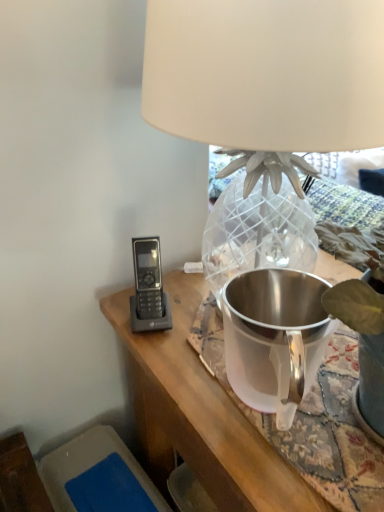
Image resolution: width=384 pixels, height=512 pixels. I want to click on satin silver pitcher at center, so click(x=274, y=338).

What is the approximate width of satin silver pitcher at center?

satin silver pitcher at center is 5.18 inches wide.

Measure the distance between satin silver pitcher at center and camera.

A distance of 18.31 inches exists between satin silver pitcher at center and camera.

Describe the element at coordinates (274, 338) in the screenshot. This screenshot has width=384, height=512. I see `satin silver pitcher at center` at that location.

At what (x,y) coordinates should I click in order to perform the action: click on matte white lampshade at upper center. Please return your answer as a coordinate pair (x, y). This screenshot has width=384, height=512. Looking at the image, I should click on (x=266, y=73).

Describe the element at coordinates (266, 73) in the screenshot. I see `matte white lampshade at upper center` at that location.

The height and width of the screenshot is (512, 384). What are the coordinates of `satin silver pitcher at center` in the screenshot? It's located at (274, 338).

Does satin silver pitcher at center appear on the left side of matte white lampshade at upper center?

Yes, satin silver pitcher at center is to the left of matte white lampshade at upper center.

Considering the positions of objects satin silver pitcher at center and matte white lampshade at upper center in the image provided, who is behind, satin silver pitcher at center or matte white lampshade at upper center?

satin silver pitcher at center is behind.

Between point (259, 397) and point (327, 116), which one is positioned in front?

The point (327, 116) is in front.

From the image's perspective, is satin silver pitcher at center over matte white lampshade at upper center?

Incorrect, from the image's perspective, satin silver pitcher at center is lower than matte white lampshade at upper center.

From a real-world perspective, which is physically above, satin silver pitcher at center or matte white lampshade at upper center?

In real-world perspective, matte white lampshade at upper center is above.

Which object is wider, satin silver pitcher at center or matte white lampshade at upper center?

With larger width is matte white lampshade at upper center.

Can you confirm if satin silver pitcher at center is taller than matte white lampshade at upper center?

In fact, satin silver pitcher at center may be shorter than matte white lampshade at upper center.

Looking at the image, does satin silver pitcher at center seem bigger or smaller compared to matte white lampshade at upper center?

Clearly, satin silver pitcher at center is smaller in size than matte white lampshade at upper center.

Is satin silver pitcher at center situated inside matte white lampshade at upper center or outside?

satin silver pitcher at center lies within the bounds of matte white lampshade at upper center.

Are satin silver pitcher at center and matte white lampshade at upper center located far from each other?

That's not correct — satin silver pitcher at center is a little close to matte white lampshade at upper center.

Is satin silver pitcher at center oriented towards matte white lampshade at upper center?

Yes, satin silver pitcher at center is aimed at matte white lampshade at upper center.

How different are the orientations of satin silver pitcher at center and matte white lampshade at upper center in degrees?

The angle between the facing direction of satin silver pitcher at center and the facing direction of matte white lampshade at upper center is 0.00037 degrees.

Identify the location of appliance on the left of matte white lampshade at upper center. (274, 338).

Does matte white lampshade at upper center appear on the right side of satin silver pitcher at center?

Yes, matte white lampshade at upper center is to the right of satin silver pitcher at center.

Which object is closer to the camera, matte white lampshade at upper center or satin silver pitcher at center?

matte white lampshade at upper center is more forward.

Which is in front, point (367, 3) or point (244, 310)?

The point (367, 3) is in front.

From the image's perspective, is matte white lampshade at upper center located beneath satin silver pitcher at center?

No.

From a real-world perspective, between matte white lampshade at upper center and satin silver pitcher at center, who is vertically higher?

From a 3D spatial view, matte white lampshade at upper center is above.

Can you confirm if matte white lampshade at upper center is thinner than satin silver pitcher at center?

No, matte white lampshade at upper center is not thinner than satin silver pitcher at center.

Does matte white lampshade at upper center have a lesser height compared to satin silver pitcher at center?

In fact, matte white lampshade at upper center may be taller than satin silver pitcher at center.

Which of these two, matte white lampshade at upper center or satin silver pitcher at center, is bigger?

matte white lampshade at upper center.

Is matte white lampshade at upper center positioned beyond the bounds of satin silver pitcher at center?

Absolutely, matte white lampshade at upper center is external to satin silver pitcher at center.

Is the surface of matte white lampshade at upper center in direct contact with satin silver pitcher at center?

No, matte white lampshade at upper center is not in contact with satin silver pitcher at center.

Is matte white lampshade at upper center facing away from satin silver pitcher at center?

No, satin silver pitcher at center is not at the back of matte white lampshade at upper center.

Find the location of a particular element. This screenshot has height=512, width=384. appliance below the matte white lampshade at upper center (from a real-world perspective) is located at coordinates (274, 338).

Locate an element on the screen. Image resolution: width=384 pixels, height=512 pixels. lamp located on the right of satin silver pitcher at center is located at coordinates (266, 73).

Locate an element on the screen. The height and width of the screenshot is (512, 384). lamp that appears above the satin silver pitcher at center (from a real-world perspective) is located at coordinates (266, 73).